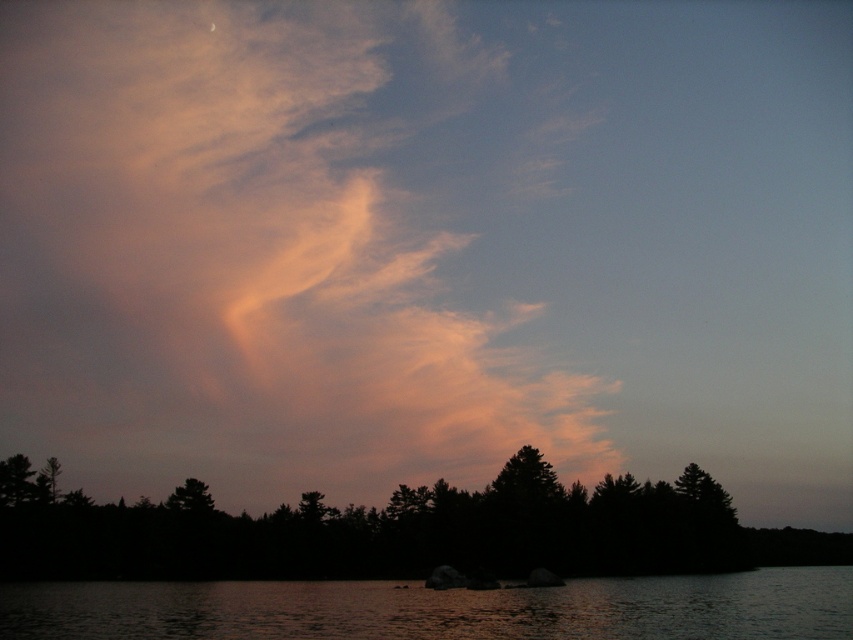
Between translucent pink cloud at upper center and dark water at lower center, which one has more height?

With more height is translucent pink cloud at upper center.

Find the location of `translucent pink cloud at upper center`. translucent pink cloud at upper center is located at coordinates (282, 248).

I want to click on translucent pink cloud at upper center, so click(x=282, y=248).